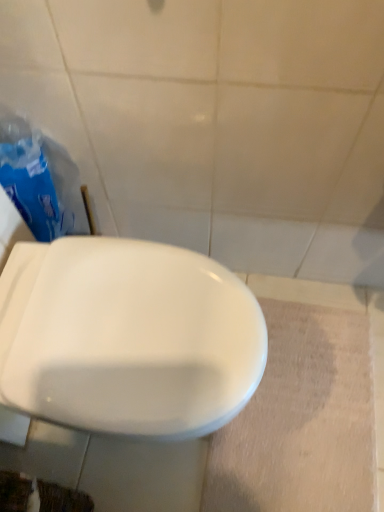
Measure the distance between point (210, 426) and camera.

They are 28.03 inches apart.

This screenshot has height=512, width=384. What do you see at coordinates (127, 337) in the screenshot?
I see `white glossy toilet at center` at bounding box center [127, 337].

Find the location of a particular element. This screenshot has height=512, width=384. white glossy toilet at center is located at coordinates (127, 337).

Where is `blue plastic bag at left`? Image resolution: width=384 pixels, height=512 pixels. blue plastic bag at left is located at coordinates (39, 179).

What do you see at coordinates (39, 179) in the screenshot?
I see `blue plastic bag at left` at bounding box center [39, 179].

Where is `white glossy toilet at center`? white glossy toilet at center is located at coordinates (127, 337).

Between blue plastic bag at left and white glossy toilet at center, which one appears on the left side from the viewer's perspective?

Positioned to the left is blue plastic bag at left.

Is blue plastic bag at left further to the viewer compared to white glossy toilet at center?

→ Yes.

Between point (33, 147) and point (130, 328), which one is positioned behind?

Positioned behind is point (33, 147).

From the image's perspective, is blue plastic bag at left under white glossy toilet at center?

Actually, blue plastic bag at left appears above white glossy toilet at center in the image.

From a real-world perspective, which object stands above the other?

blue plastic bag at left is physically above.

From the picture: Considering the sizes of objects blue plastic bag at left and white glossy toilet at center in the image provided, who is thinner, blue plastic bag at left or white glossy toilet at center?

Thinner between the two is blue plastic bag at left.

Which of these two, blue plastic bag at left or white glossy toilet at center, stands taller?

With more height is blue plastic bag at left.

Considering the sizes of objects blue plastic bag at left and white glossy toilet at center in the image provided, who is bigger, blue plastic bag at left or white glossy toilet at center?

With larger size is white glossy toilet at center.

In the scene shown: Is white glossy toilet at center completely or partially inside blue plastic bag at left?

No, white glossy toilet at center is not surrounded by blue plastic bag at left.

Looking at this image, is blue plastic bag at left with white glossy toilet at center?

No, blue plastic bag at left is not making contact with white glossy toilet at center.

Is blue plastic bag at left facing towards white glossy toilet at center?

No, blue plastic bag at left is not aimed at white glossy toilet at center.

Looking at this image, can you tell me how much blue plastic bag at left and white glossy toilet at center differ in facing direction?

0.00105 degrees separate the facing orientations of blue plastic bag at left and white glossy toilet at center.

The image size is (384, 512). I want to click on garbage located above the white glossy toilet at center (from a real-world perspective), so click(39, 179).

Visually, is white glossy toilet at center positioned to the left or to the right of blue plastic bag at left?

white glossy toilet at center is to the right of blue plastic bag at left.

Does white glossy toilet at center come in front of blue plastic bag at left?

Yes, it is in front of blue plastic bag at left.

Does point (65, 419) come in front of point (11, 182)?

Yes, point (65, 419) is in front of point (11, 182).

From the image's perspective, is white glossy toilet at center under blue plastic bag at left?

Correct, white glossy toilet at center appears lower than blue plastic bag at left in the image.

From a real-world perspective, relative to blue plastic bag at left, is white glossy toilet at center vertically above or below?

white glossy toilet at center is situated lower than blue plastic bag at left in the real world.

Considering the relative sizes of white glossy toilet at center and blue plastic bag at left in the image provided, is white glossy toilet at center thinner than blue plastic bag at left?

Incorrect, the width of white glossy toilet at center is not less than that of blue plastic bag at left.

Does white glossy toilet at center have a lesser height compared to blue plastic bag at left?

Yes.

Which of these two, white glossy toilet at center or blue plastic bag at left, is smaller?

Smaller between the two is blue plastic bag at left.

In the scene shown: Is white glossy toilet at center not inside blue plastic bag at left?

white glossy toilet at center lies outside blue plastic bag at left's area.

Is white glossy toilet at center not close to blue plastic bag at left?

Actually, white glossy toilet at center and blue plastic bag at left are a little close together.

Is white glossy toilet at center facing towards blue plastic bag at left?

No.

How different are the orientations of white glossy toilet at center and blue plastic bag at left in degrees?

0.00105 degrees.

Identify the location of toilet on the right of blue plastic bag at left. The width and height of the screenshot is (384, 512). (127, 337).

At what (x,y) coordinates should I click in order to perform the action: click on garbage above the white glossy toilet at center (from a real-world perspective). Please return your answer as a coordinate pair (x, y). The width and height of the screenshot is (384, 512). Looking at the image, I should click on (39, 179).

The image size is (384, 512). I want to click on toilet below the blue plastic bag at left (from the image's perspective), so click(x=127, y=337).